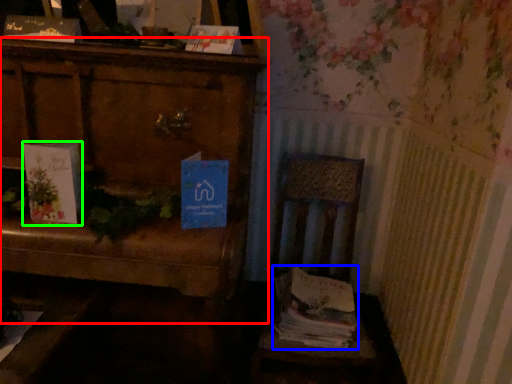
Question: Which object is the farthest from furniture (highlighted by a red box)? Choose among these: magazine (highlighted by a blue box) or book (highlighted by a green box).

Choices:
 (A) magazine
 (B) book

Answer: (A)